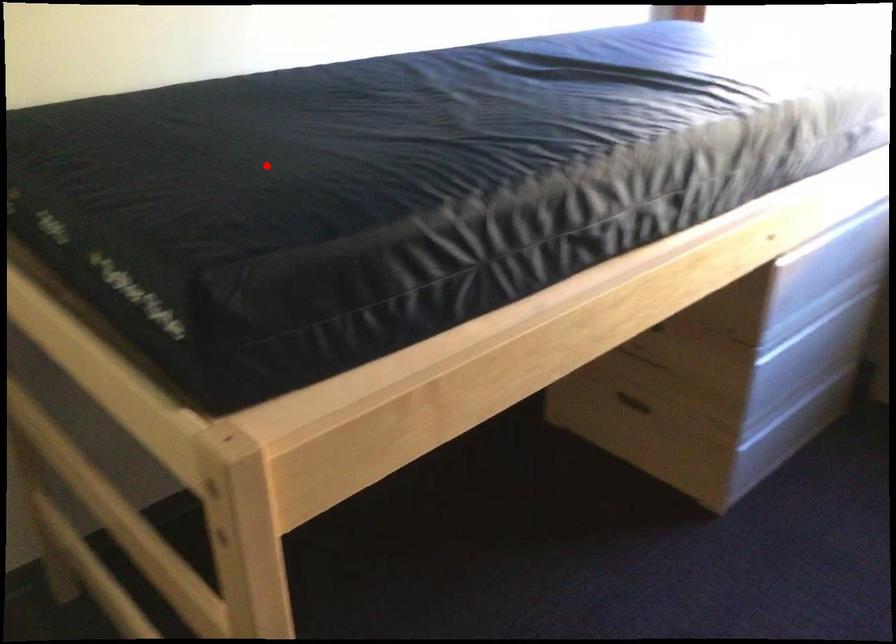
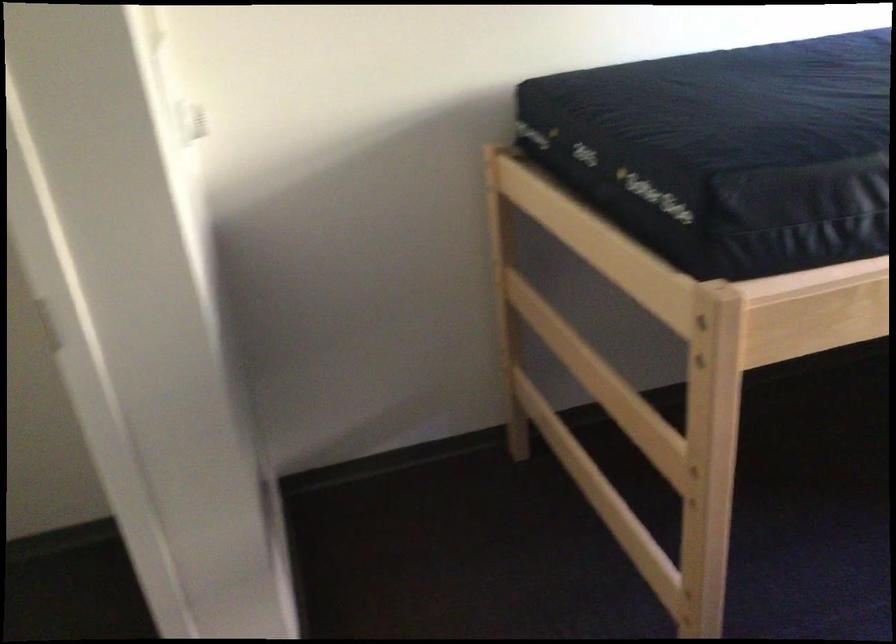
The point at the highlighted location is marked in the first image. Where is the corresponding point in the second image?

(753, 108)